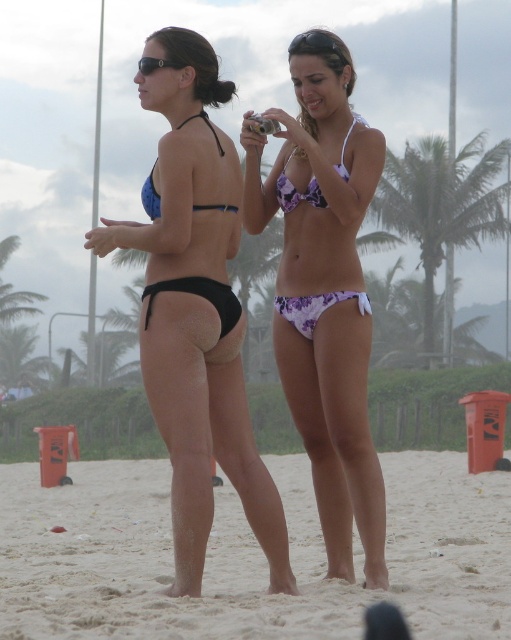
Question: Is black matte bikini bottom at center positioned before black matte bikini at left?

Choices:
 (A) no
 (B) yes

Answer: (B)

Question: Among these objects, which one is farthest from the camera?

Choices:
 (A) purple floral fabric bikini at center
 (B) green leafy palm tree at upper center
 (C) black plastic sunglasses at upper center

Answer: (B)

Question: Which point is closer to the camera taking this photo?

Choices:
 (A) (318, 387)
 (B) (428, 252)

Answer: (A)

Question: Is black plastic goggles at upper center wider than black plastic sunglasses at upper center?

Choices:
 (A) yes
 (B) no

Answer: (B)

Question: Is sandy beach at lower center smaller than black plastic goggles at upper center?

Choices:
 (A) yes
 (B) no

Answer: (B)

Question: Which point is closer to the camera?

Choices:
 (A) black matte bikini bottom at center
 (B) black plastic goggles at upper center
 (C) purple floral bikini top at center
 (D) black plastic sunglasses at upper center

Answer: (A)